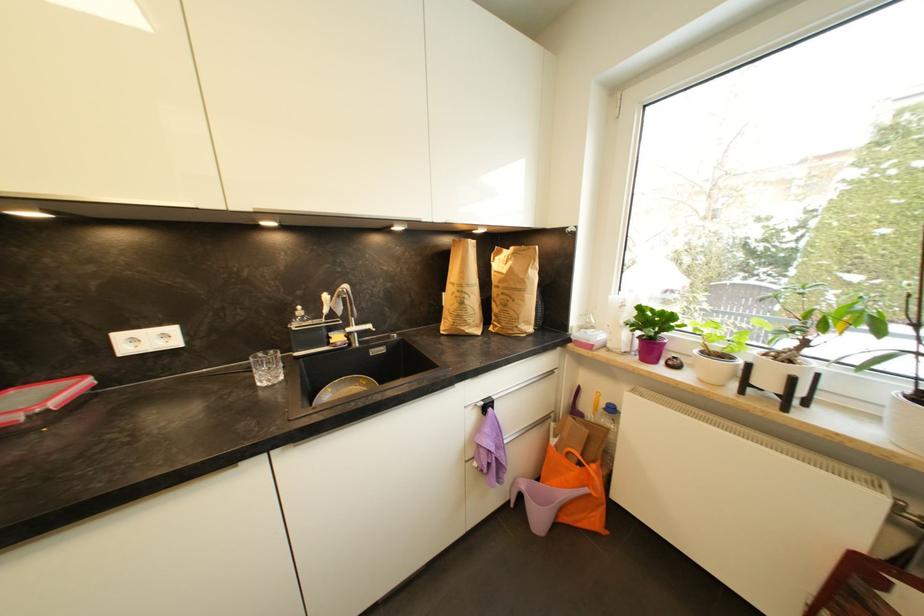
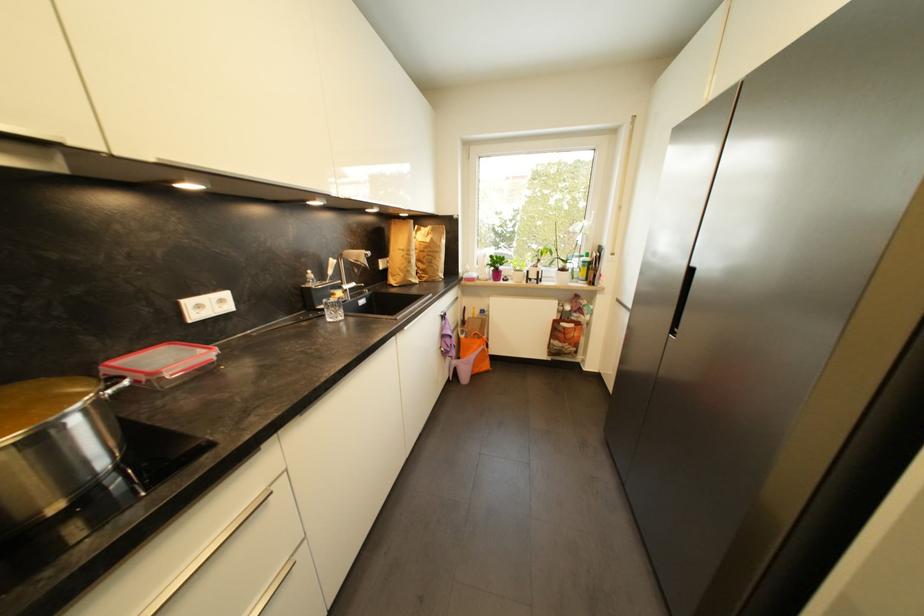
Where in the second image is the point corresponding to pixel 169 338 from the first image?

(226, 302)